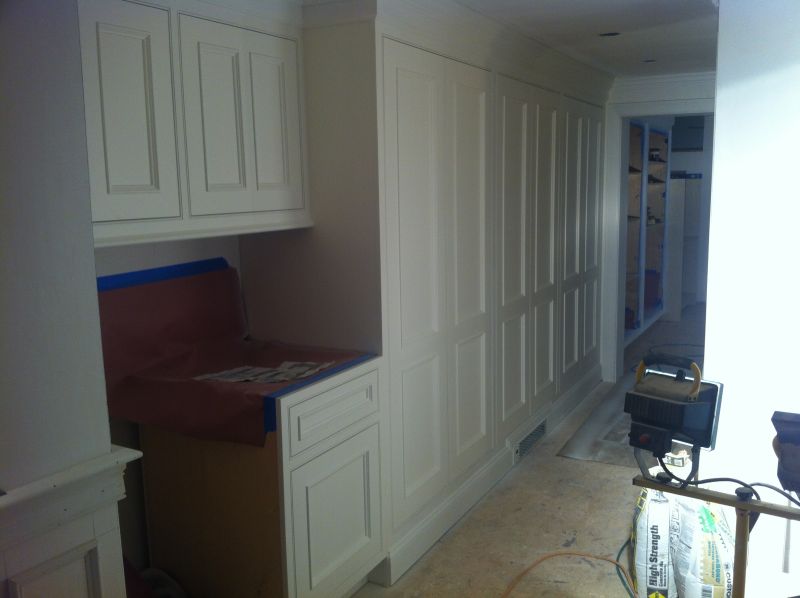
I want to click on lower cupboard, so click(326, 477).